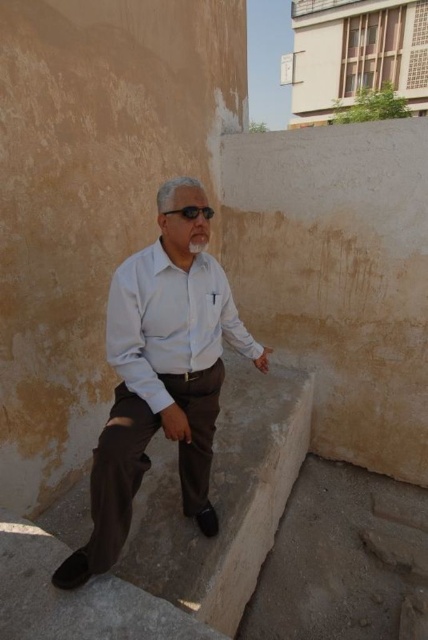
Question: Which point appears farthest from the camera in this image?

Choices:
 (A) (140, 371)
 (B) (187, 216)

Answer: (A)

Question: Which object is farther from the camera taking this photo?

Choices:
 (A) light blue shirt at center
 (B) light blue cotton shirt at center
 (C) black matte sunglasses at center

Answer: (C)

Question: Which of the following is the farthest from the observer?

Choices:
 (A) light blue shirt at center
 (B) black matte sunglasses at center
 (C) light blue cotton shirt at center

Answer: (B)

Question: Is light blue cotton shirt at center wider than black matte sunglasses at center?

Choices:
 (A) yes
 (B) no

Answer: (A)

Question: Is light blue shirt at center wider than black matte sunglasses at center?

Choices:
 (A) yes
 (B) no

Answer: (A)

Question: Does light blue cotton shirt at center lie behind black matte sunglasses at center?

Choices:
 (A) no
 (B) yes

Answer: (A)